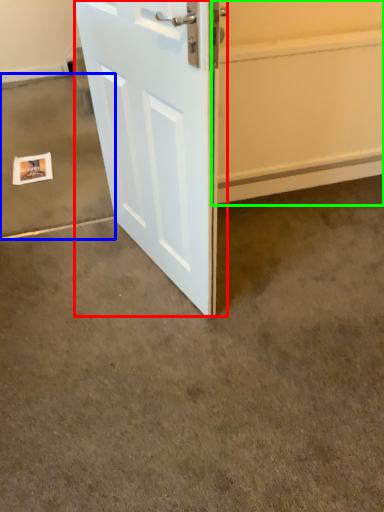
Question: Which object is the closest to the door (highlighted by a red box)? Choose among these: concrete (highlighted by a blue box) or garage door (highlighted by a green box).

Choices:
 (A) concrete
 (B) garage door

Answer: (B)